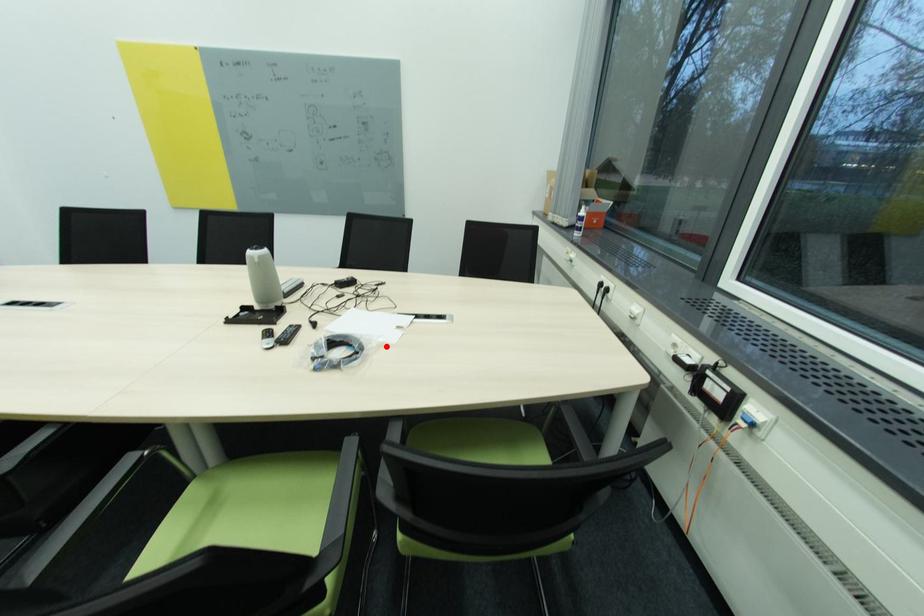
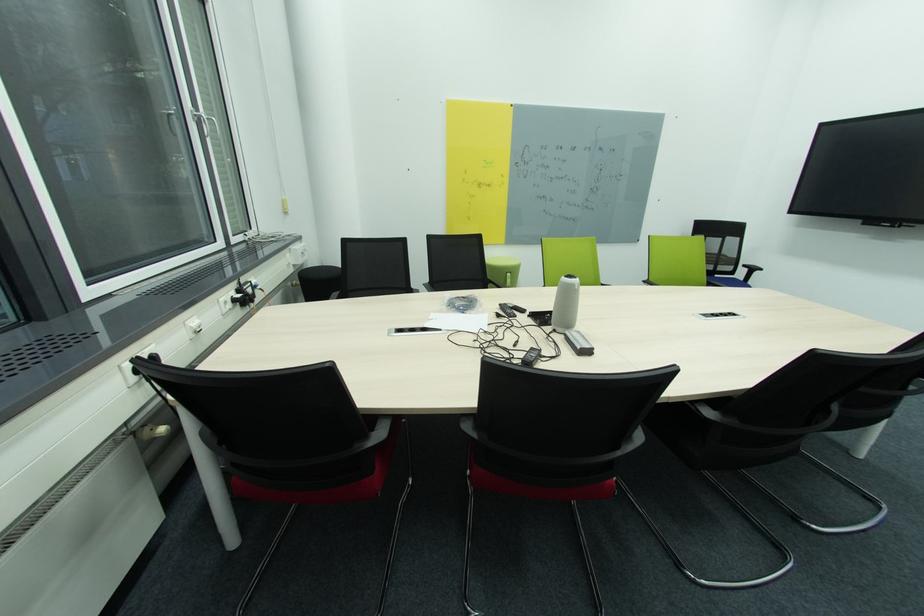
In the second image, find the point that corresponds to the highlighted location in the first image.

(444, 313)